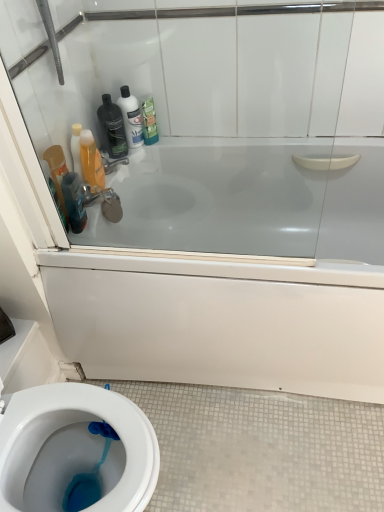
Identify the location of vacant area situated below transparent glass door at upper center (from a real-world perspective). This screenshot has height=512, width=384. (178, 256).